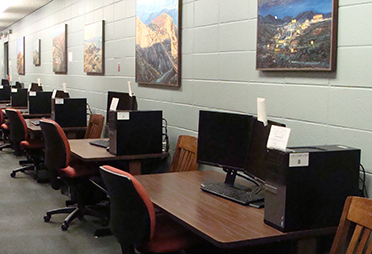
You are a GUI agent. You are given a task and a screenshot of the screen. Output one action in this format:
    pyautogui.click(x=<x>, y=<y>)
    Task: Click on the computer monitor
    
    Given the screenshot: What is the action you would take?
    pyautogui.click(x=243, y=143), pyautogui.click(x=254, y=150), pyautogui.click(x=123, y=99)